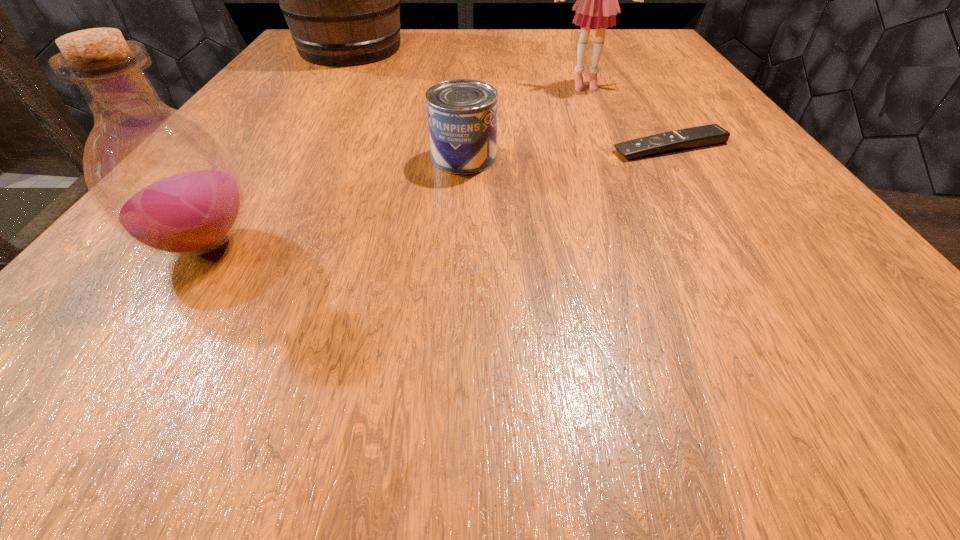
Image resolution: width=960 pixels, height=540 pixels. What are the coordinates of `free point between the farthest object and the fourth shortest object` in the screenshot? It's located at (468, 66).

The width and height of the screenshot is (960, 540). I want to click on free point between the bottle and the second shortest object, so click(x=334, y=201).

Image resolution: width=960 pixels, height=540 pixels. In order to click on vacant area that lies between the tallest object and the doll in this screenshot , I will do `click(468, 66)`.

Where is `free spot between the fourth nearest object and the tallest object`? free spot between the fourth nearest object and the tallest object is located at coordinates (468, 66).

Identify the location of free spot between the shortest object and the fourth tallest object. (567, 152).

Identify which object is the third closest to the remote control. Please provide its 2D coordinates. Your answer should be formatted as a tuple, i.e. [(x, y)], where the tuple contains the x and y coordinates of a point satisfying the conditions above.

[(341, 0)]

This screenshot has width=960, height=540. I want to click on object that is the closest to the doll, so click(x=712, y=134).

Image resolution: width=960 pixels, height=540 pixels. What are the coordinates of `vacant space that satisfies the following two spatial constraints: 1. on the front-facing side of the second farthest object; 2. on the front label of the second shortest object` in the screenshot? It's located at (614, 157).

Image resolution: width=960 pixels, height=540 pixels. I want to click on free space that satisfies the following two spatial constraints: 1. on the front-facing side of the second tallest object; 2. on the front label of the fourth tallest object, so click(614, 157).

The image size is (960, 540). What are the coordinates of `vacant space that satisfies the following two spatial constraints: 1. on the front-facing side of the remote control; 2. on the left side of the doll` in the screenshot? It's located at (611, 147).